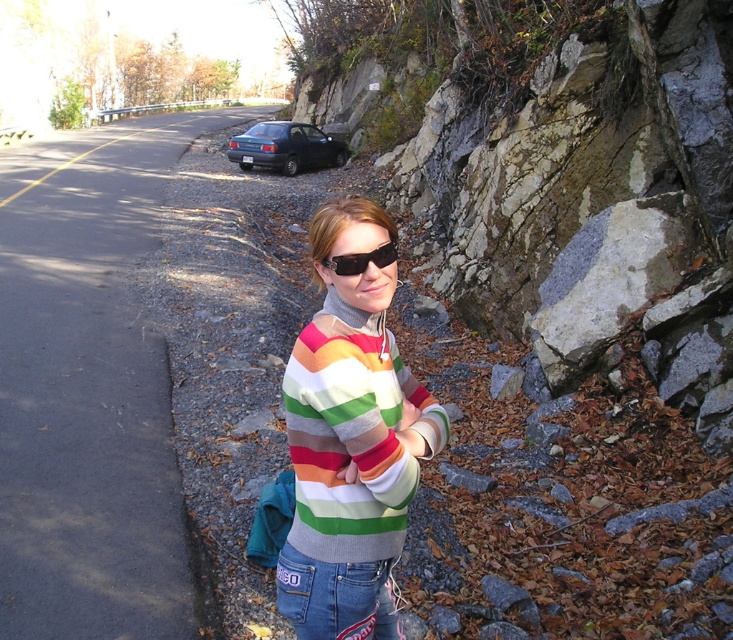
Is point (386, 579) positioned behind point (325, 266)?

Yes.

Is rainbow striped sweater at center below black plastic sunglasses at center?

Correct, rainbow striped sweater at center is located below black plastic sunglasses at center.

Which is behind, point (303, 506) or point (342, 259)?

Point (303, 506)

Identify the location of rainbow striped sweater at center. (350, 440).

Does gravel at left have a lesser width compared to rainbow striped sweater at center?

No, gravel at left is not thinner than rainbow striped sweater at center.

Is point (106, 577) positioned in front of point (372, 276)?

No, it is not.

Image resolution: width=733 pixels, height=640 pixels. Describe the element at coordinates (89, 388) in the screenshot. I see `gravel at left` at that location.

Identify the location of gravel at left. (89, 388).

Does gray/granite rock at right have a larger size compared to black plastic sunglasses at center?

Yes.

Does gray/granite rock at right appear on the right side of black plastic sunglasses at center?

Correct, you'll find gray/granite rock at right to the right of black plastic sunglasses at center.

Is point (578, 237) farther from camera compared to point (325, 259)?

Yes, it is.

You are a GUI agent. You are given a task and a screenshot of the screen. Output one action in this format:
    pyautogui.click(x=<x>, y=<y>)
    Task: Click on the gray/granite rock at right
    This screenshot has width=733, height=640.
    Given the screenshot: What is the action you would take?
    pyautogui.click(x=611, y=280)